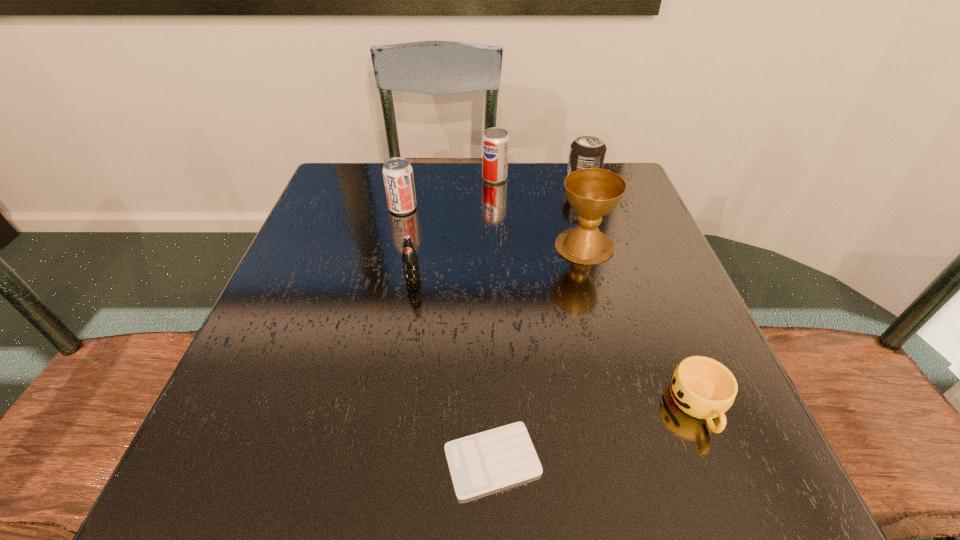
You are a GUI agent. You are given a task and a screenshot of the screen. Output one action in this format:
    pyautogui.click(x=<x>, y=<y>)
    Task: Click on the cup located in the right edge section of the desktop
    
    Given the screenshot: What is the action you would take?
    coord(702,387)

Find the location of `object that is at the far right corner`. object that is at the far right corner is located at coordinates (588, 150).

This screenshot has width=960, height=540. In order to click on vacant region at the far edge of the desktop in this screenshot , I will do `click(488, 184)`.

Find the location of a particular element. The image size is (960, 540). blank space at the near edge is located at coordinates (573, 492).

Locate an element on the screen. vacant space at the left edge is located at coordinates (215, 435).

In the image, there is a desktop. At what (x,y) coordinates should I click in order to perform the action: click on vacant space at the right edge. Please return your answer as a coordinate pair (x, y). Image resolution: width=960 pixels, height=540 pixels. Looking at the image, I should click on tap(653, 307).

This screenshot has width=960, height=540. Find the location of `free point at the near left corner`. free point at the near left corner is located at coordinates (216, 468).

Locate an element on the screen. free location at the far right corner of the desktop is located at coordinates (617, 171).

This screenshot has width=960, height=540. I want to click on vacant space that's between the third pop from left to right and the cup, so click(x=597, y=292).

Image resolution: width=960 pixels, height=540 pixels. Find the location of `free space between the second pop from left to right and the calculator`. free space between the second pop from left to right and the calculator is located at coordinates (453, 370).